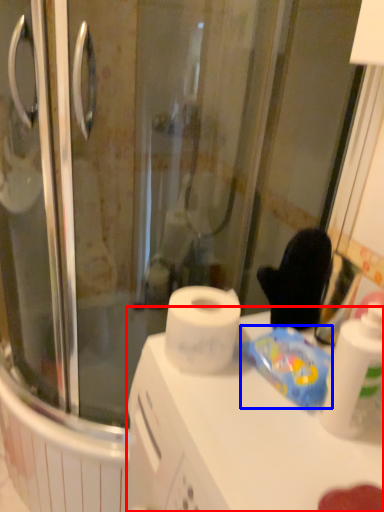
Question: Which object appears farthest to the camera in this image, counter top (highlighted by a red box) or food (highlighted by a blue box)?

Choices:
 (A) counter top
 (B) food

Answer: (B)